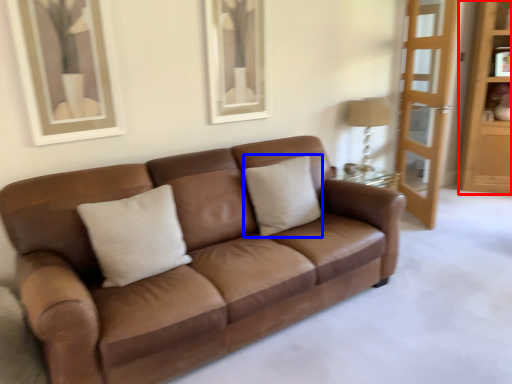
Question: Which point is further to the camera, dresser (highlighted by a red box) or pillow (highlighted by a blue box)?

Choices:
 (A) dresser
 (B) pillow

Answer: (A)